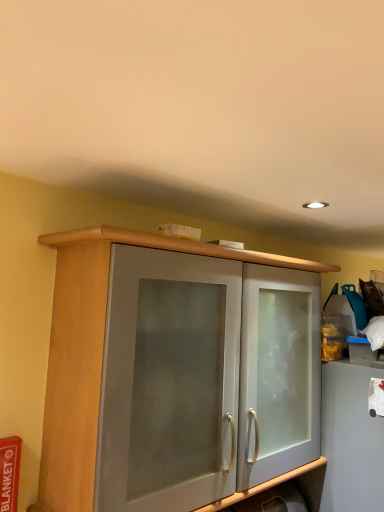
What do you see at coordinates (95, 351) in the screenshot? I see `satin wood cabinet at center` at bounding box center [95, 351].

Identify the location of satin wood cabinet at center. [95, 351].

Looking at this image, measure the distance between point (92,332) and camera.

They are 3.54 feet apart.

Where is `satin wood cabinet at center`? The image size is (384, 512). satin wood cabinet at center is located at coordinates (95, 351).